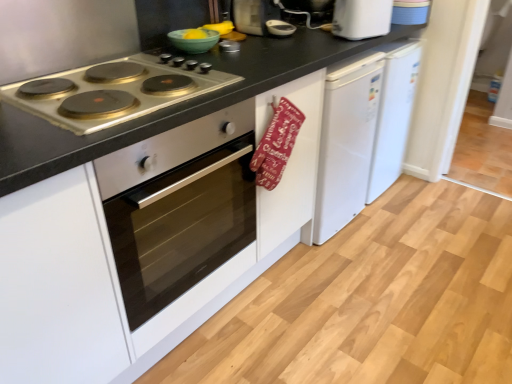
Where is `vacant area that lies to the right of green matte bowl at upper center`? The width and height of the screenshot is (512, 384). vacant area that lies to the right of green matte bowl at upper center is located at coordinates (247, 49).